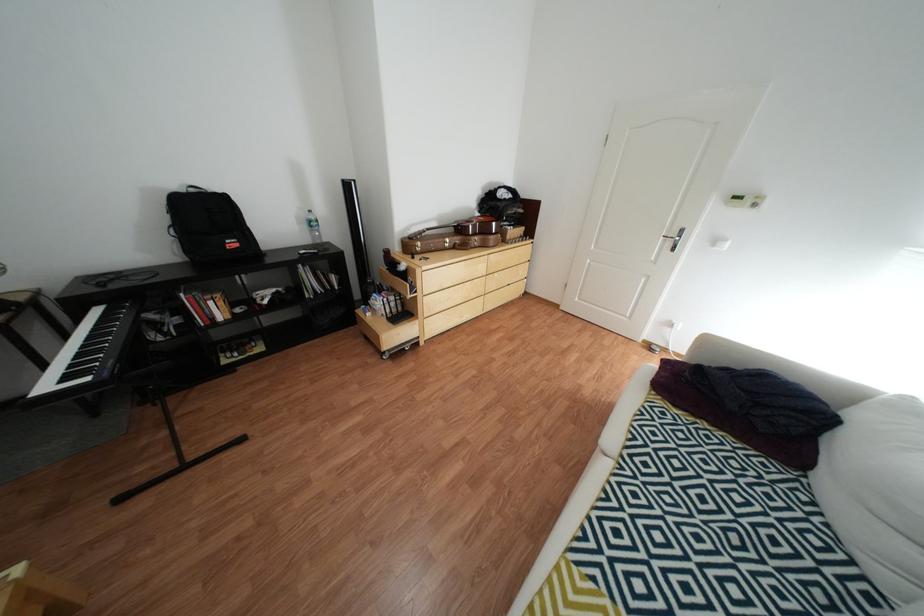
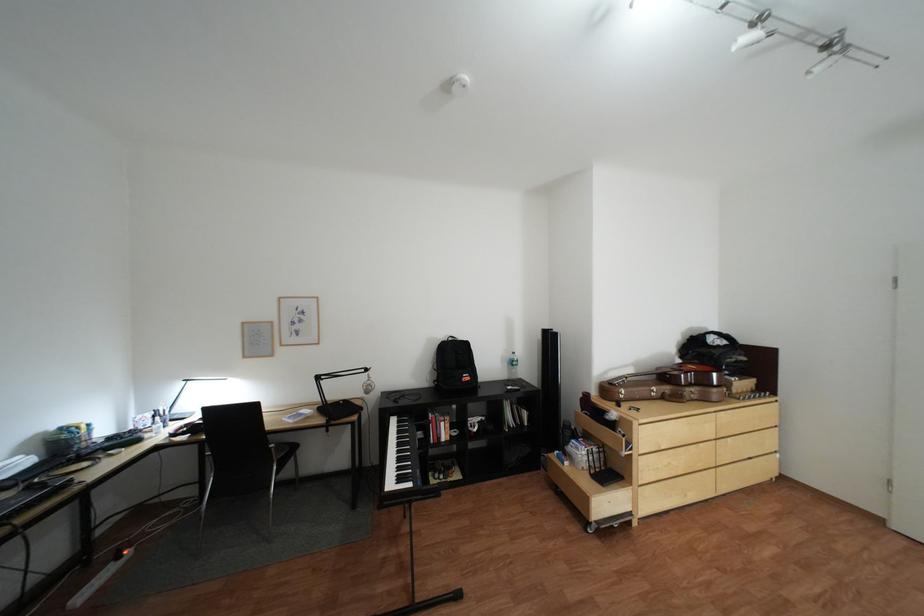
In the second image, find the point that corresponds to (x=393, y=339) in the first image.

(602, 500)